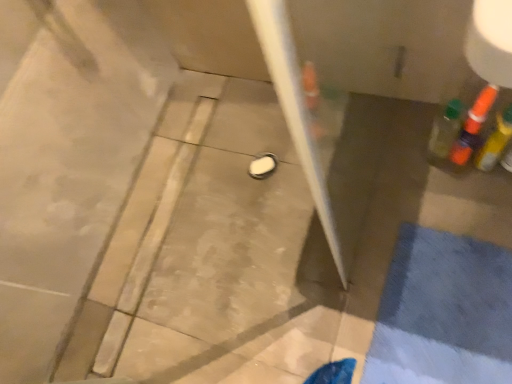
Question: From the image's perspective, is translucent orange bottle at upper right, placed as the 2th bottle when sorted from left to right, located above or below translucent plastic bottle at right, which is counted as the first bottle, starting from the left?

Choices:
 (A) above
 (B) below

Answer: (A)

Question: Visually, is translucent orange bottle at upper right, placed as the 2th bottle when sorted from left to right, positioned to the left or to the right of translucent plastic bottle at right, the third bottle positioned from the right?

Choices:
 (A) right
 (B) left

Answer: (A)

Question: Considering the real-world distances, which object is farthest from the translucent plastic bottle at right, which is counted as the first bottle, starting from the left?

Choices:
 (A) translucent orange bottle at upper right, the second bottle when ordered from right to left
 (B) translucent orange bottle at right, arranged as the 3th bottle when viewed from the left

Answer: (B)

Question: Estimate the real-world distances between objects in this image. Which object is closer to the translucent plastic bottle at right, the third bottle positioned from the right?

Choices:
 (A) translucent orange bottle at upper right, placed as the 2th bottle when sorted from left to right
 (B) translucent orange bottle at right, arranged as the 3th bottle when viewed from the left

Answer: (A)